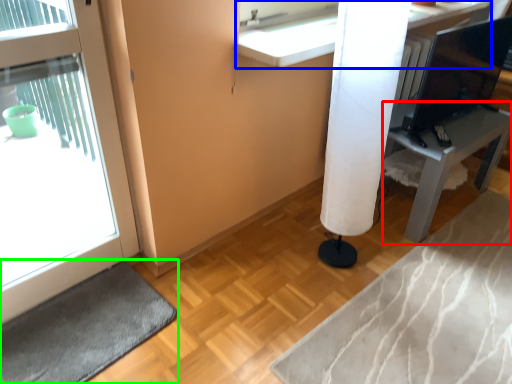
Question: Which is nearer to the furniture (highlighted by a red box)? counter (highlighted by a blue box) or bath mat (highlighted by a green box).

Choices:
 (A) counter
 (B) bath mat

Answer: (A)